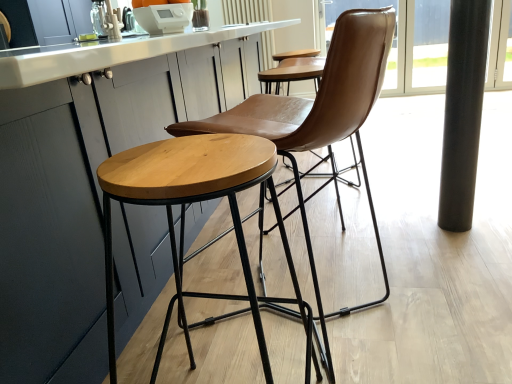
At what (x,y) coordinates should I click in order to perform the action: click on free region on the left part of black polished pole at right. Please return your answer as a coordinate pair (x, y). Image resolution: width=512 pixels, height=384 pixels. Looking at the image, I should click on 415,224.